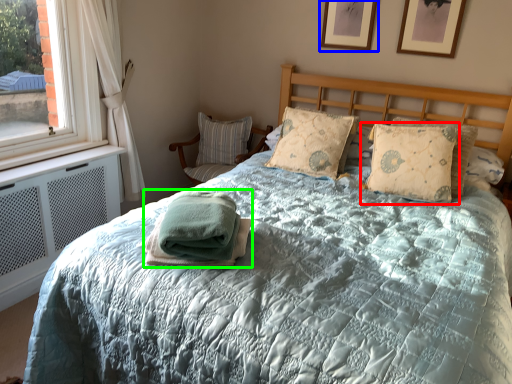
Question: Which is nearer to the pillow (highlighted by a red box)? picture frame (highlighted by a blue box) or blanket (highlighted by a green box).

Choices:
 (A) picture frame
 (B) blanket

Answer: (A)